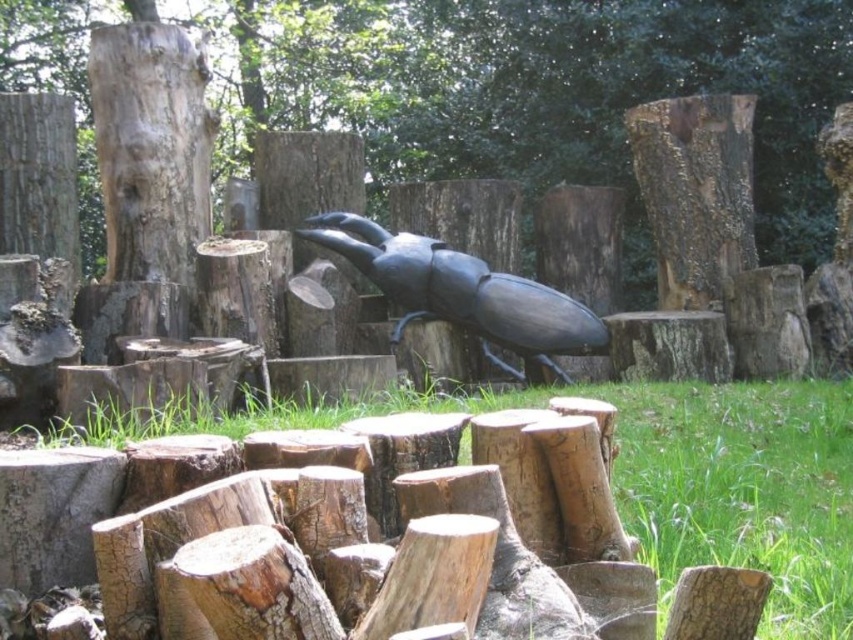
Question: Does smooth wood stump at center have a greater width compared to black matte beetle at center?

Choices:
 (A) yes
 (B) no

Answer: (B)

Question: Is smooth wood stump at center below smooth brown tree trunk at upper left?

Choices:
 (A) yes
 (B) no

Answer: (B)

Question: Which of the following is the closest to the observer?

Choices:
 (A) (288, 122)
 (B) (107, 70)
 (C) (463, 296)

Answer: (B)

Question: Is the position of green grass at center more distant than that of smooth brown tree trunk at upper left?

Choices:
 (A) no
 (B) yes

Answer: (A)

Question: Among these objects, which one is farthest from the camera?

Choices:
 (A) green grass at center
 (B) black matte beetle at center
 (C) smooth wood stump at center
 (D) smooth brown tree trunk at upper left

Answer: (C)

Question: Estimate the real-world distances between objects in this image. Which object is closer to the smooth wood stump at center?

Choices:
 (A) smooth brown tree trunk at upper left
 (B) green grass at center

Answer: (B)